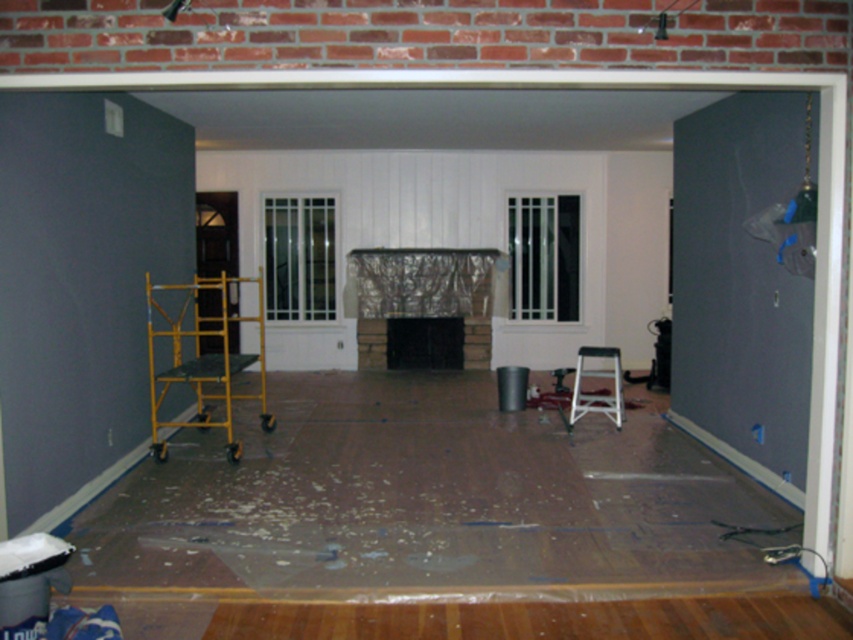
You are a delivery person with a box that requires a 4 meter wide path to move through. You are currently standing in the center of the room and see the matte gray door at right. Is there enough space to move the box to the door without tilting it?

The path between the center of the room and the matte gray door at right is 4.44 meters wide, which is wider than the required 4 meters. Therefore, there is enough space to move the box to the door without tilting it.

You are a contractor measuring the space between the matte gray door at right and the yellow metal scaffolding at left. Which object has a greater width?

The yellow metal scaffolding at left has a greater width than the matte gray door at right.

You are a construction worker entering the room and see the matte gray door at right and the white plastic stool at center. Which object is located to the right of the other?

The matte gray door at right is located to the right of the white plastic stool at center.